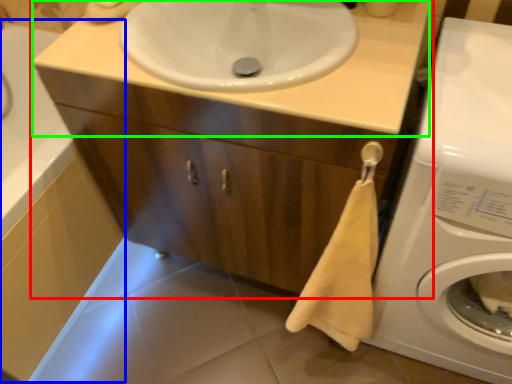
Question: Which is farther away from bathroom cabinet (highlighted by a red box)? bath (highlighted by a blue box) or counter top (highlighted by a green box)?

Choices:
 (A) bath
 (B) counter top

Answer: (A)